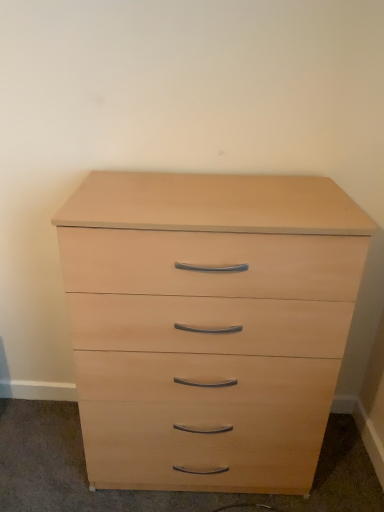
What do you see at coordinates (207, 289) in the screenshot? The width and height of the screenshot is (384, 512). I see `light wood chest of drawers at center` at bounding box center [207, 289].

Identify the location of light wood chest of drawers at center. The image size is (384, 512). (207, 289).

Identify the location of light wood chest of drawers at center. (x=207, y=289).